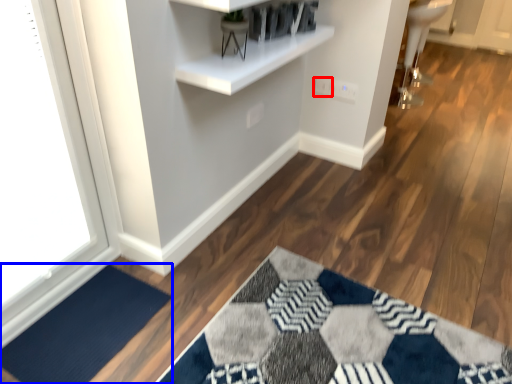
Question: Which object is closer to the camera taking this photo, electric outlet (highlighted by a red box) or doormat (highlighted by a blue box)?

Choices:
 (A) electric outlet
 (B) doormat

Answer: (B)